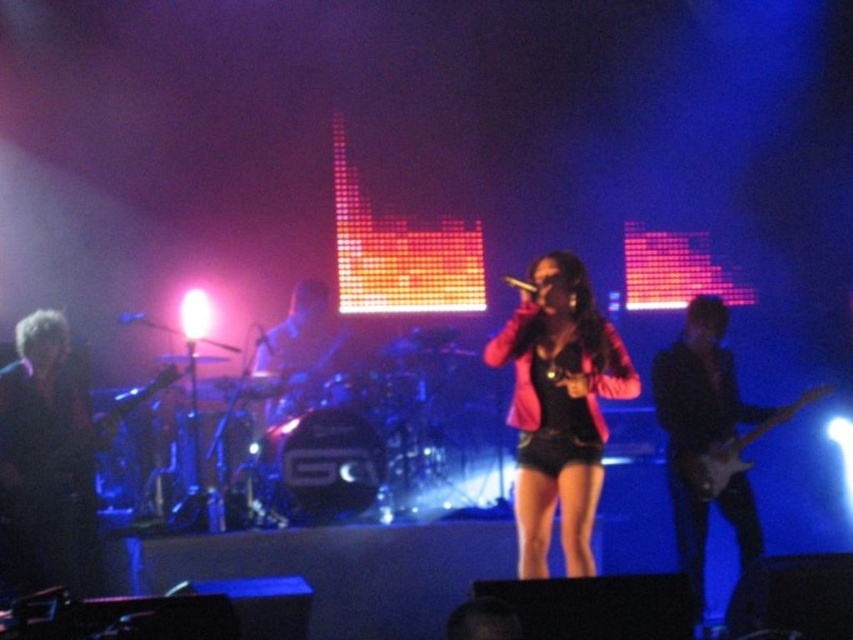
Who is higher up, pink matte jacket at center or metallic silver microphone at center?

metallic silver microphone at center is above.

Can you confirm if pink matte jacket at center is positioned to the left of metallic silver microphone at center?

Incorrect, pink matte jacket at center is not on the left side of metallic silver microphone at center.

Between point (550, 436) and point (264, 339), which one is positioned in front?

Point (550, 436)

In order to click on pink matte jacket at center in this screenshot , I will do `click(560, 410)`.

Is pink matte jacket at center positioned behind black matte microphone at center?

No, pink matte jacket at center is closer to the viewer.

Is pink matte jacket at center wider than black matte microphone at center?

Yes.

Locate an element on the screen. pink matte jacket at center is located at coordinates (560, 410).

Find the location of `pink matte jacket at center`. pink matte jacket at center is located at coordinates (560, 410).

Can you confirm if glossy electric guitar at right is smaller than black matte microphone at left?

No.

Which is behind, point (782, 410) or point (13, 360)?

The point (13, 360) is more distant.

At what (x,y) coordinates should I click in order to perform the action: click on glossy electric guitar at right. Please return your answer as a coordinate pair (x, y). This screenshot has height=640, width=853. Looking at the image, I should click on (734, 451).